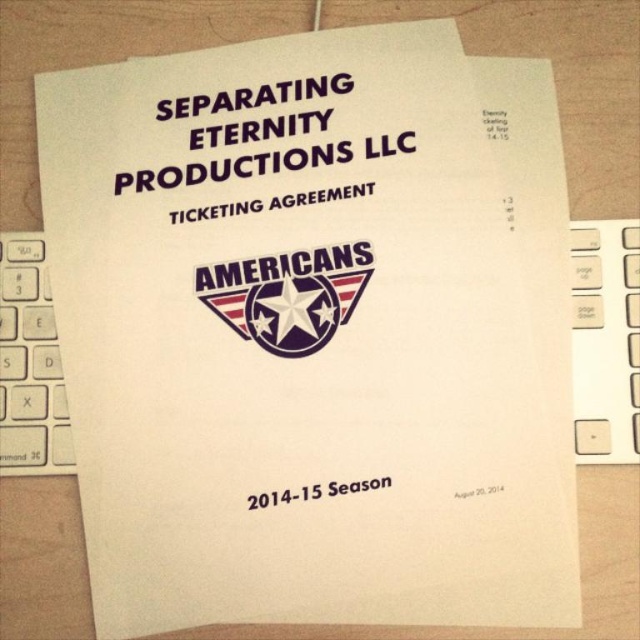
You are a document reviewer and need to place a stamp on the document. The stamp is 1 inch in diameter. Where should you place it to avoid covering the white plastic keyboard at upper center?

The white plastic keyboard at upper center is located at point [605,340]. To avoid covering it, place the stamp in an area not overlapping with that coordinate, such as near the bottom margin where there is no keyboard present.

You are organizing a display for a history museum and need to place the white plastic keyboard at upper center and the metallic silver star at center on a shelf. The shelf has a width of 15 inches. If the keyboard is 10 inches wide and the star is 12 inches wide, will both items fit side by side on the shelf without overlapping?

The white plastic keyboard at upper center has a lesser width compared to metallic silver star at center. Since the keyboard is 10 inches and the star is 12 inches, together they require 22 inches. The shelf is only 15 inches wide, so they cannot fit side by side without overlapping.